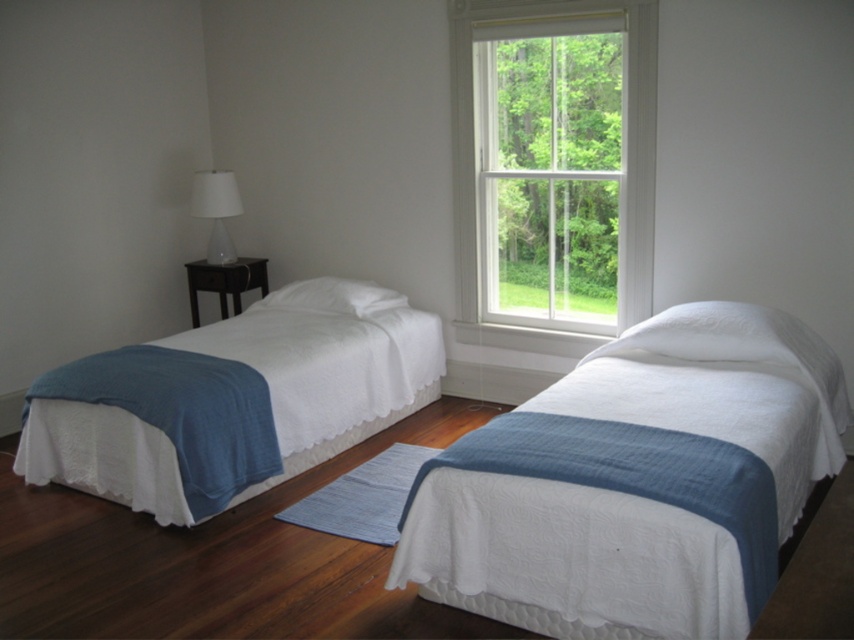
Measure the distance between point (x=577, y=308) and camera.

Point (x=577, y=308) and camera are 14.70 feet apart.

Is clear glass window at center thinner than white quilted bed at left?

Yes, clear glass window at center is thinner than white quilted bed at left.

Is point (457, 38) more distant than point (338, 404)?

That is True.

Where is `clear glass window at center`? The image size is (854, 640). clear glass window at center is located at coordinates (553, 170).

Which is more to the right, white quilted bed at center or white soft pillow at center?

white quilted bed at center is more to the right.

What do you see at coordinates (569, 557) in the screenshot? The height and width of the screenshot is (640, 854). I see `white quilted bed at center` at bounding box center [569, 557].

This screenshot has width=854, height=640. Identify the location of white quilted bed at center. (569, 557).

Is white quilted bed at center shorter than white matte lamp at left?

In fact, white quilted bed at center may be taller than white matte lamp at left.

Can you confirm if white quilted bed at center is positioned to the right of white matte lamp at left?

Indeed, white quilted bed at center is positioned on the right side of white matte lamp at left.

Locate an element on the screen. The width and height of the screenshot is (854, 640). white quilted bed at center is located at coordinates (569, 557).